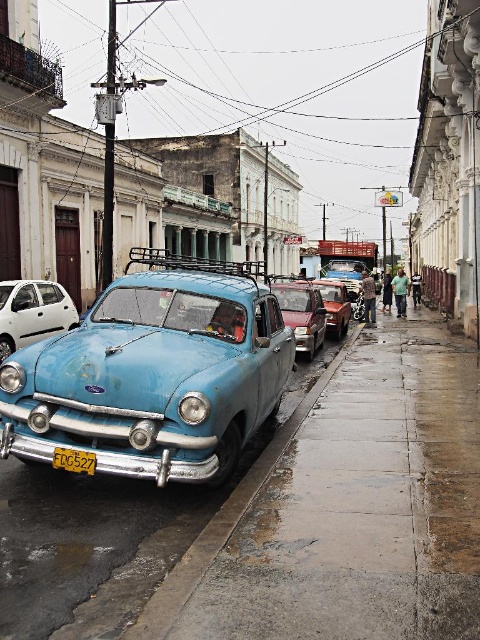
Question: Is concrete sidewalk at lower left positioned behind yellow matte license plate at center?

Choices:
 (A) yes
 (B) no

Answer: (B)

Question: Does white matte car at left have a larger size compared to yellow matte license plate at center?

Choices:
 (A) no
 (B) yes

Answer: (B)

Question: Which object is positioned closest to the metallic red car at center?

Choices:
 (A) yellow matte license plate at center
 (B) white matte car at left
 (C) rusty blue car at left

Answer: (B)

Question: Is metallic red car at center below yellow matte license plate at center?

Choices:
 (A) yes
 (B) no

Answer: (B)

Question: Which object is closer to the camera taking this photo?

Choices:
 (A) yellow matte license plate at center
 (B) rusty metal car at center
 (C) metallic red car at center
 (D) rusty blue car at left

Answer: (D)

Question: Which object is farther from the camera taking this photo?

Choices:
 (A) yellow matte license plate at center
 (B) white matte car at left
 (C) concrete sidewalk at lower left
 (D) rusty blue car at left

Answer: (B)